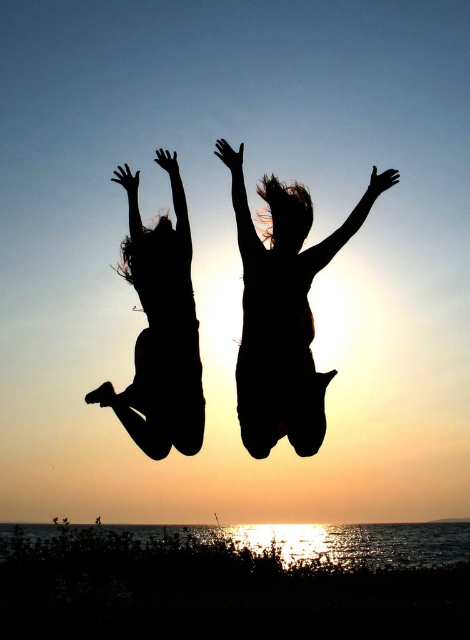
In the scene shown: You are a photographer trying to capture the scene with the black matte silhouette at center and the black silhouette girl at left. Which figure is closer to the camera based on their positions?

The black matte silhouette at center is closer to the camera because it is positioned in front of the black silhouette girl at left.

You are standing at the point labeled as point (x=283, y=312) in the image. Looking towards the sunset, which direction should you face to see the black matte silhouette at center?

The point labeled as point (x=283, y=312) is the location of the black matte silhouette at center. Since you are already at that point, you would need to look towards the horizon where the sunset is occurring to see the silhouette, but since you are at the silhouette itself, you might not see it directly in front of you. However, based on the scene description, the silhouette is centered against the sunset backdrop, so facing towards the sunset would align you with the silhouette.